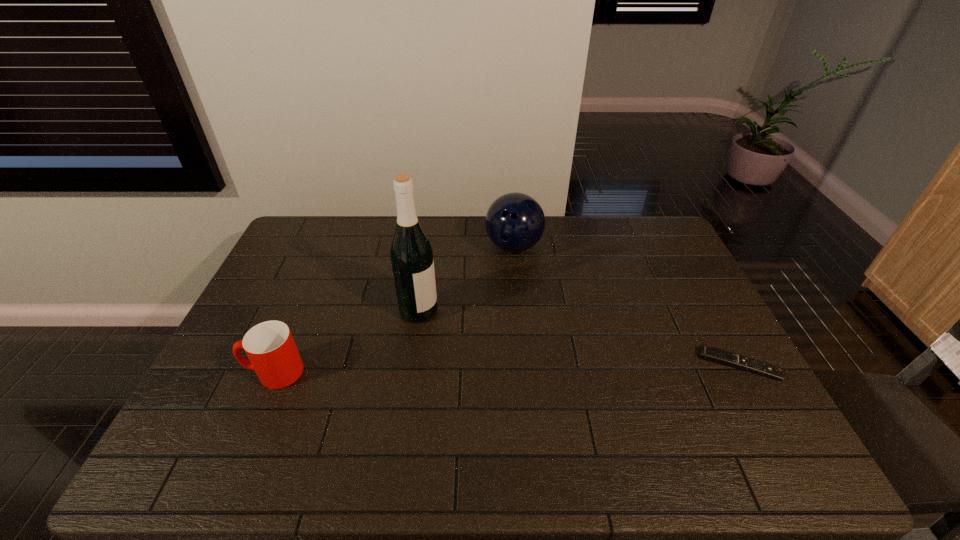
At what (x,y) coordinates should I click in order to perform the action: click on free space located on the surface of the second object from right to left near the finger holes. Please return your answer as a coordinate pair (x, y). The height and width of the screenshot is (540, 960). Looking at the image, I should click on (512, 304).

You are a GUI agent. You are given a task and a screenshot of the screen. Output one action in this format:
    pyautogui.click(x=<x>, y=<y>)
    Task: Click on the free location located 0.160m on the surface of the second object from right to left near the finger holes
    The height and width of the screenshot is (540, 960).
    Given the screenshot: What is the action you would take?
    pyautogui.click(x=512, y=297)

Identify the location of vacant space located 0.120m on the label of the wine bottle. The image size is (960, 540). (469, 332).

I want to click on free region located on the label of the wine bottle, so click(516, 352).

Where is `vacant space located on the label of the wine bottle`? vacant space located on the label of the wine bottle is located at coordinates (451, 325).

Where is `object at the far edge`? The image size is (960, 540). object at the far edge is located at coordinates (515, 222).

Locate an element on the screen. The image size is (960, 540). object present at the left edge is located at coordinates (270, 347).

The height and width of the screenshot is (540, 960). In order to click on object at the right edge in this screenshot , I will do `click(708, 353)`.

Identify the location of free region at the far edge of the desktop. Image resolution: width=960 pixels, height=540 pixels. (452, 235).

Identify the location of free space at the near edge. (333, 411).